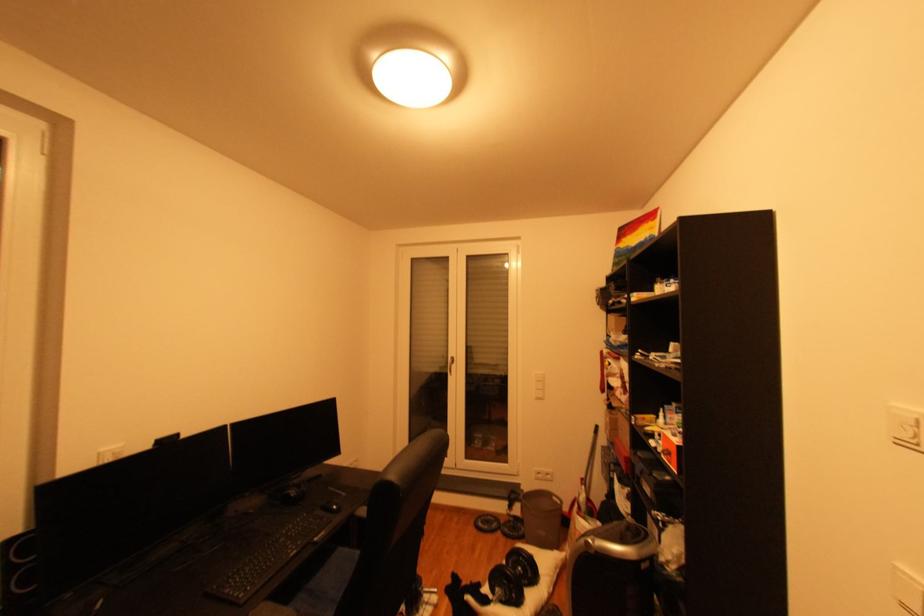
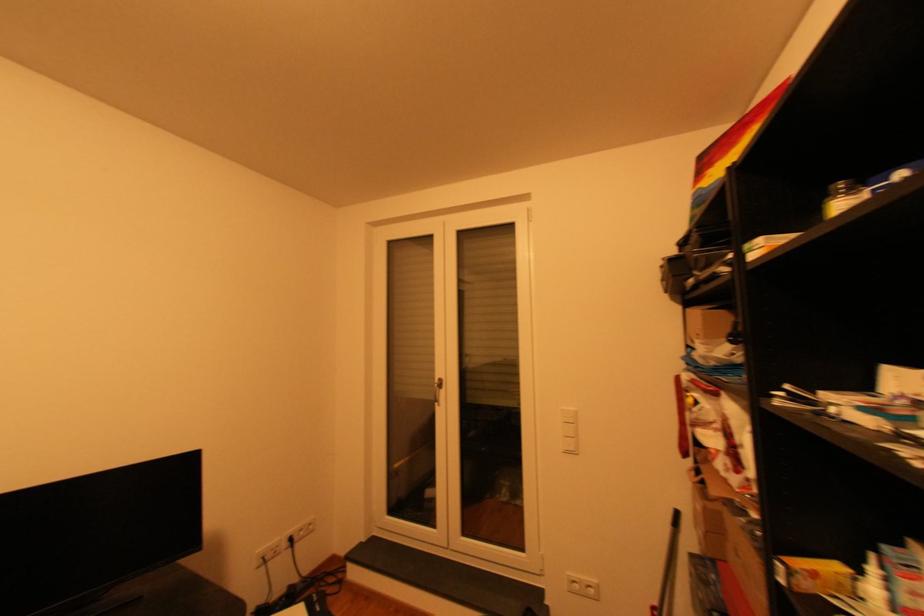
Find the pixel in the second image that matches [546,399] in the first image.

(576, 453)